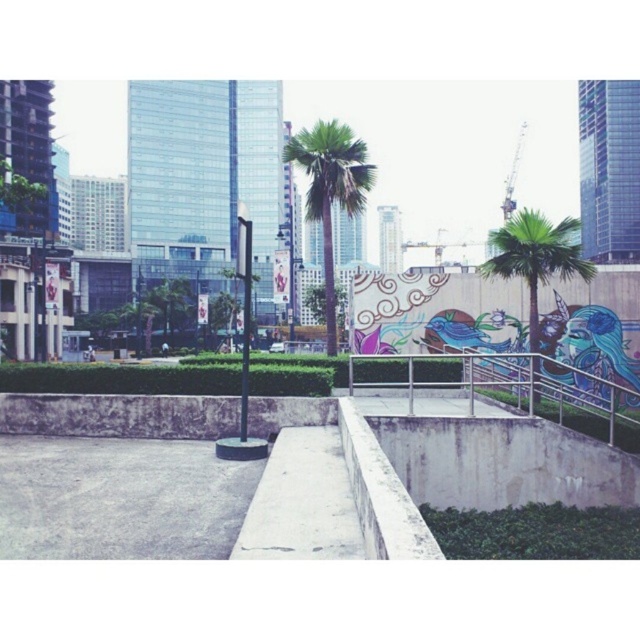
Does metallic silver railing at center appear on the left side of green leafy palm at center?

In fact, metallic silver railing at center is to the right of green leafy palm at center.

Describe the element at coordinates (528, 390) in the screenshot. The height and width of the screenshot is (640, 640). I see `metallic silver railing at center` at that location.

Does point (579, 419) come in front of point (312, 182)?

Yes, it is.

Identify the location of metallic silver railing at center. This screenshot has height=640, width=640. (528, 390).

Does point (513, 406) come closer to viewer compared to point (490, 241)?

Yes, it is in front of point (490, 241).

Is metallic silver railing at center wider than green leafy palm tree at right?

Yes.

Who is more distant from viewer, (410, 412) or (531, 241)?

The point (531, 241) is behind.

Identify the location of metallic silver railing at center. (528, 390).

Can you confirm if green leafy palm at center is positioned to the left of green leafy palm tree at right?

Indeed, green leafy palm at center is positioned on the left side of green leafy palm tree at right.

Does point (324, 248) lie behind point (500, 244)?

Yes, it is behind point (500, 244).

This screenshot has width=640, height=640. Identify the location of green leafy palm at center. coord(330,189).